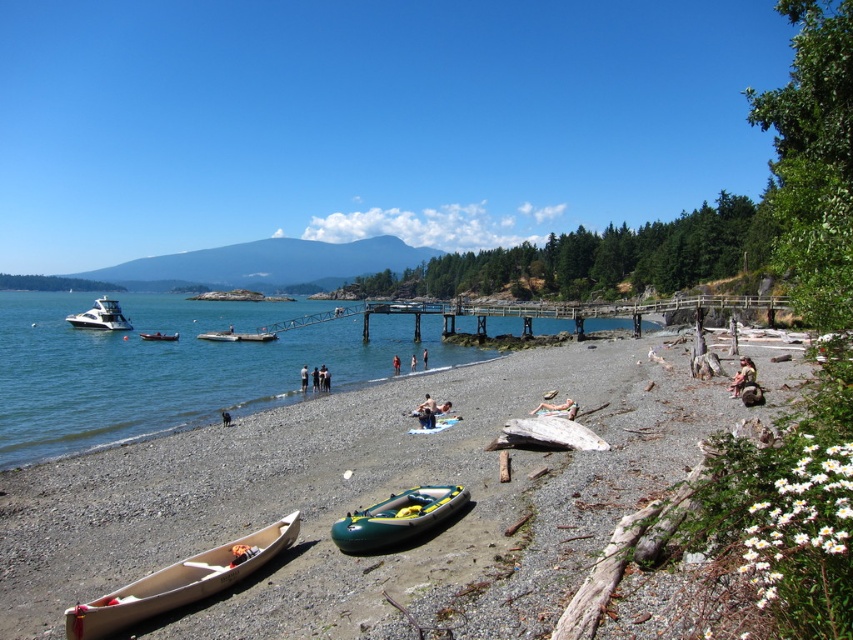
Question: Does white plastic boat at left appear under red fabric person at center?

Choices:
 (A) no
 (B) yes

Answer: (A)

Question: Estimate the real-world distances between objects in this image. Which object is farther from the tan fabric towel at center?

Choices:
 (A) shiny white motorboat at left
 (B) smooth sand beach at center

Answer: (A)

Question: Does tan fabric towel at lower center have a smaller size compared to white plastic boat at left?

Choices:
 (A) no
 (B) yes

Answer: (B)

Question: Which object is the farthest from the green rubber dinghy at center?

Choices:
 (A) tan fabric towel at lower center
 (B) tan fabric towel at center
 (C) white plastic boat at left
 (D) smooth sand beach at center

Answer: (A)

Question: Which of the following is the farthest from the observer?

Choices:
 (A) light brown wooden canoe at lower left
 (B) tan fabric towel at lower center
 (C) green rubber canoe at center
 (D) white plastic boat at left

Answer: (D)

Question: Is light brown wooden canoe at lower left wider than black fabric person at center?

Choices:
 (A) no
 (B) yes

Answer: (B)